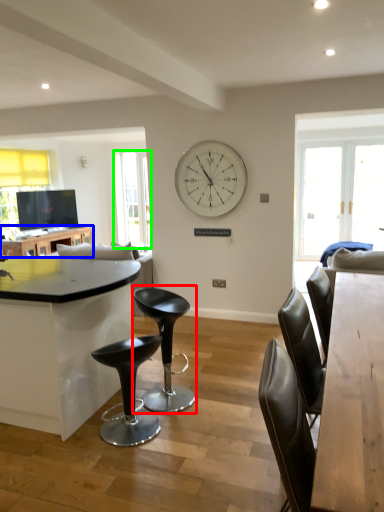
Question: Estimate the real-world distances between objects in this image. Which object is farther from chair (highlighted by a red box), table (highlighted by a blue box) or window screen (highlighted by a green box)?

Choices:
 (A) table
 (B) window screen

Answer: (B)